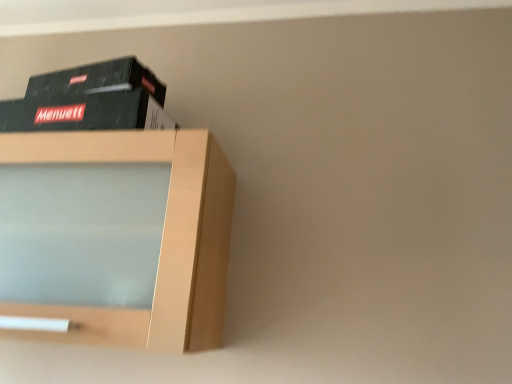
Question: Does black matte book at upper left have a larger size compared to light wood shelf at upper left?

Choices:
 (A) yes
 (B) no

Answer: (B)

Question: From a real-world perspective, is black matte book at upper left physically below light wood shelf at upper left?

Choices:
 (A) no
 (B) yes

Answer: (A)

Question: Is the depth of black matte book at upper left greater than that of light wood shelf at upper left?

Choices:
 (A) no
 (B) yes

Answer: (B)

Question: From the image's perspective, is black matte book at upper left over light wood shelf at upper left?

Choices:
 (A) yes
 (B) no

Answer: (A)

Question: Is black matte book at upper left facing towards light wood shelf at upper left?

Choices:
 (A) yes
 (B) no

Answer: (B)

Question: Does black matte book at upper left have a greater width compared to light wood shelf at upper left?

Choices:
 (A) yes
 (B) no

Answer: (B)

Question: From a real-world perspective, is light wood shelf at upper left physically below black matte book at upper left?

Choices:
 (A) yes
 (B) no

Answer: (A)

Question: Are light wood shelf at upper left and black matte book at upper left located far from each other?

Choices:
 (A) no
 (B) yes

Answer: (A)

Question: Is light wood shelf at upper left outside black matte book at upper left?

Choices:
 (A) no
 (B) yes

Answer: (B)

Question: From the image's perspective, does light wood shelf at upper left appear lower than black matte book at upper left?

Choices:
 (A) yes
 (B) no

Answer: (A)

Question: Does light wood shelf at upper left have a lesser width compared to black matte book at upper left?

Choices:
 (A) yes
 (B) no

Answer: (B)

Question: From a real-world perspective, is light wood shelf at upper left on top of black matte book at upper left?

Choices:
 (A) no
 (B) yes

Answer: (A)

Question: In the image, is black matte book at upper left positioned in front of or behind light wood shelf at upper left?

Choices:
 (A) front
 (B) behind

Answer: (B)